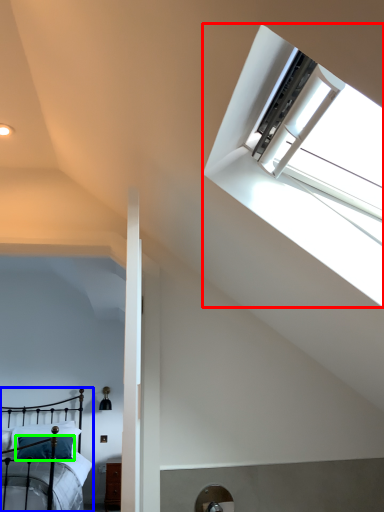
Question: Which is nearer to the window (highlighted by a red box)? bed (highlighted by a blue box) or pillow (highlighted by a green box).

Choices:
 (A) bed
 (B) pillow

Answer: (A)